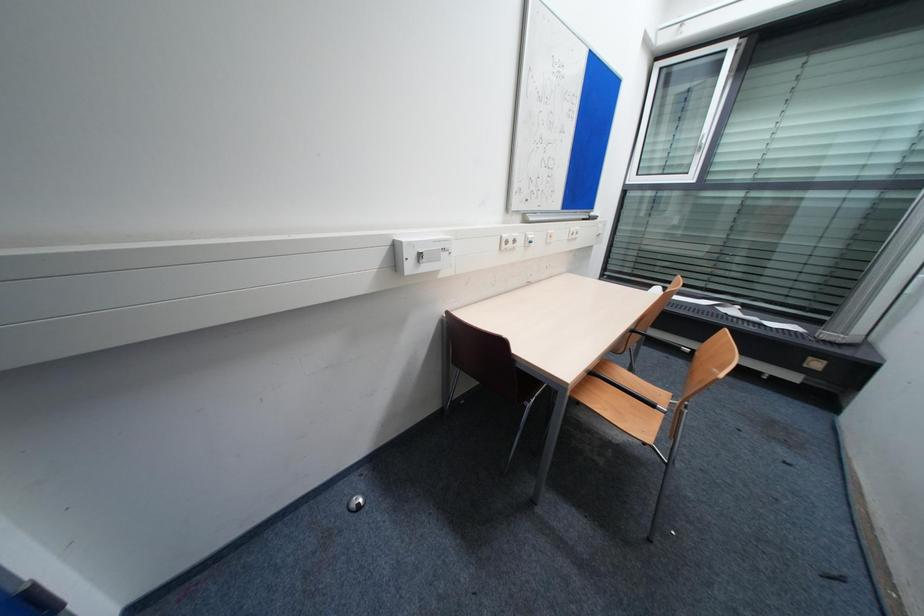
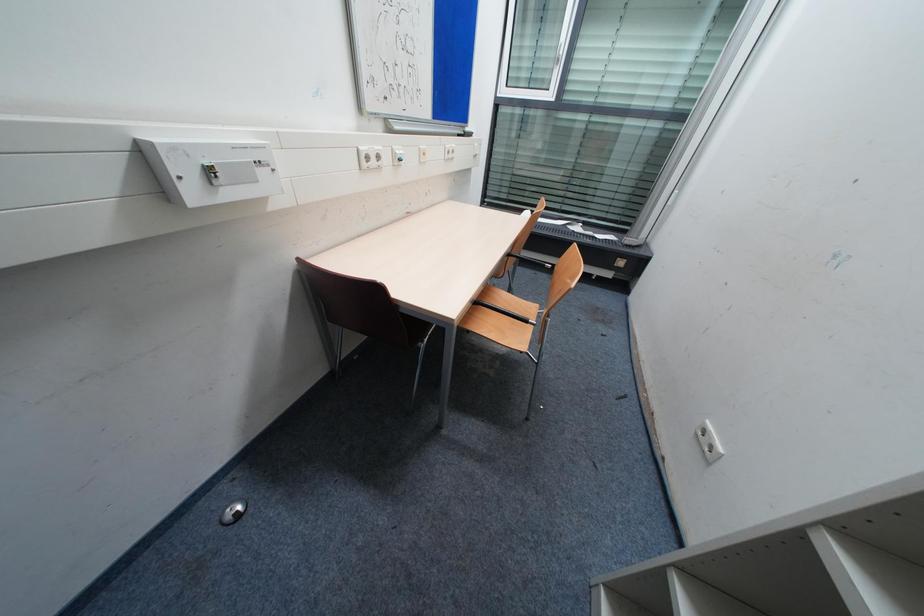
The first image is from the beginning of the video and the second image is from the end. How did the camera likely rotate when shooting the video?

The rotation direction of the camera is right-down.